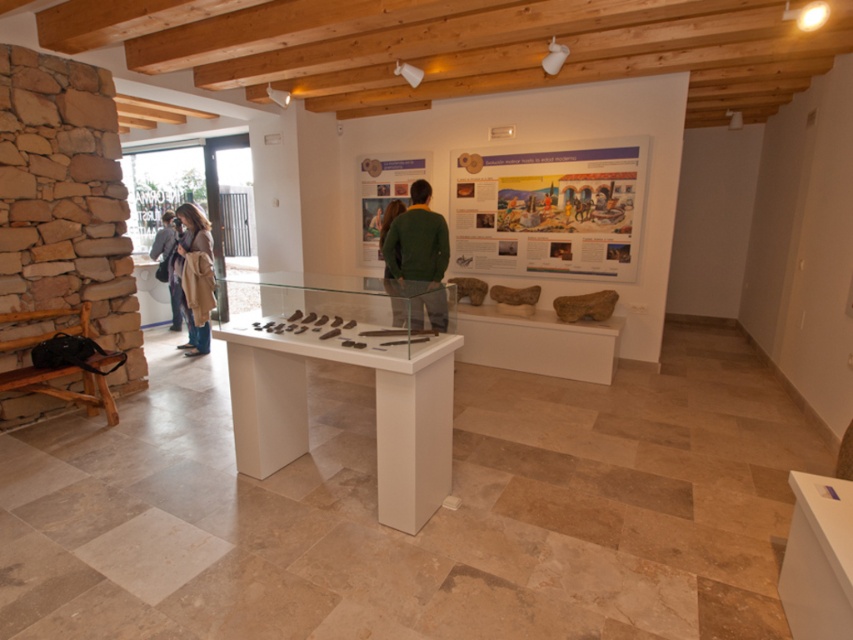
Does green matte sweater at center have a larger size compared to brown woolen coat at center?

Yes, green matte sweater at center is bigger than brown woolen coat at center.

You are a GUI agent. You are given a task and a screenshot of the screen. Output one action in this format:
    pyautogui.click(x=<x>, y=<y>)
    Task: Click on the green matte sweater at center
    The width and height of the screenshot is (853, 640).
    Given the screenshot: What is the action you would take?
    pyautogui.click(x=419, y=257)

Which is above, brown woolen coat at center or brown leather jacket at center?

Positioned higher is brown leather jacket at center.

Does brown woolen coat at center appear under brown leather jacket at center?

Yes, brown woolen coat at center is below brown leather jacket at center.

What are the coordinates of `brown woolen coat at center` in the screenshot? It's located at (196, 276).

Image resolution: width=853 pixels, height=640 pixels. I want to click on brown woolen coat at center, so click(x=196, y=276).

Which is behind, point (415, 250) or point (165, 262)?

Positioned behind is point (165, 262).

Can you confirm if green matte sweater at center is positioned below brown leather jacket at center?

Correct, green matte sweater at center is located below brown leather jacket at center.

The width and height of the screenshot is (853, 640). Describe the element at coordinates (419, 257) in the screenshot. I see `green matte sweater at center` at that location.

Locate an element on the screen. The width and height of the screenshot is (853, 640). green matte sweater at center is located at coordinates (419, 257).